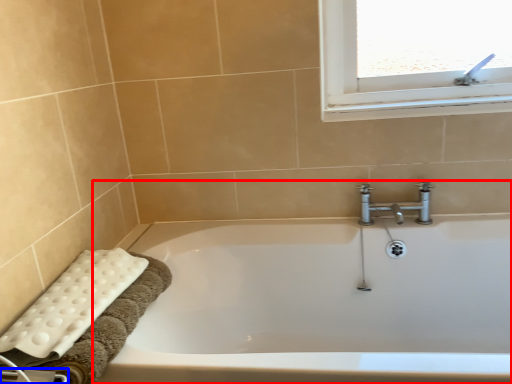
Question: Which object appears closest to the camera in this image, bathtub (highlighted by a red box) or towel bar (highlighted by a blue box)?

Choices:
 (A) bathtub
 (B) towel bar

Answer: (B)